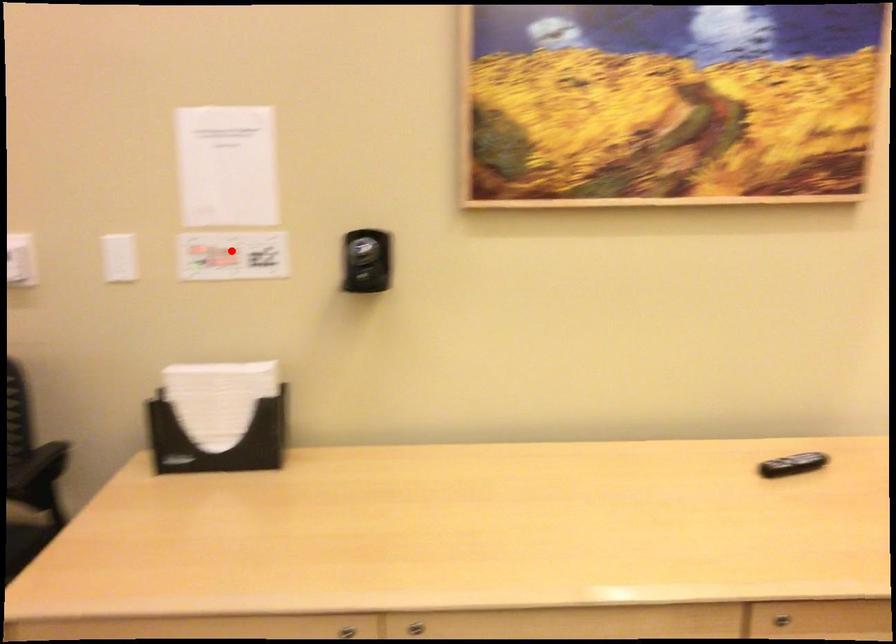
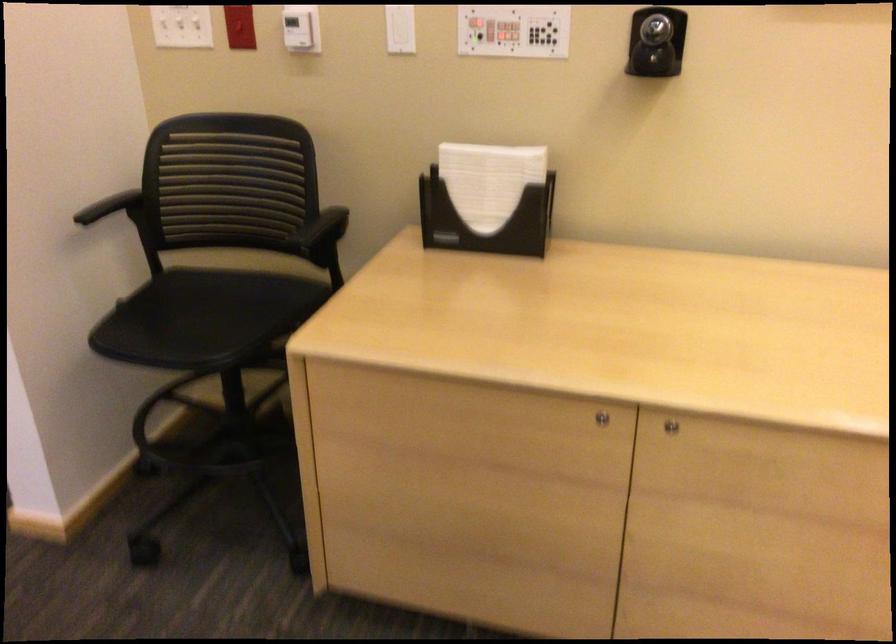
The point at the highlighted location is marked in the first image. Where is the corresponding point in the second image?

(513, 31)